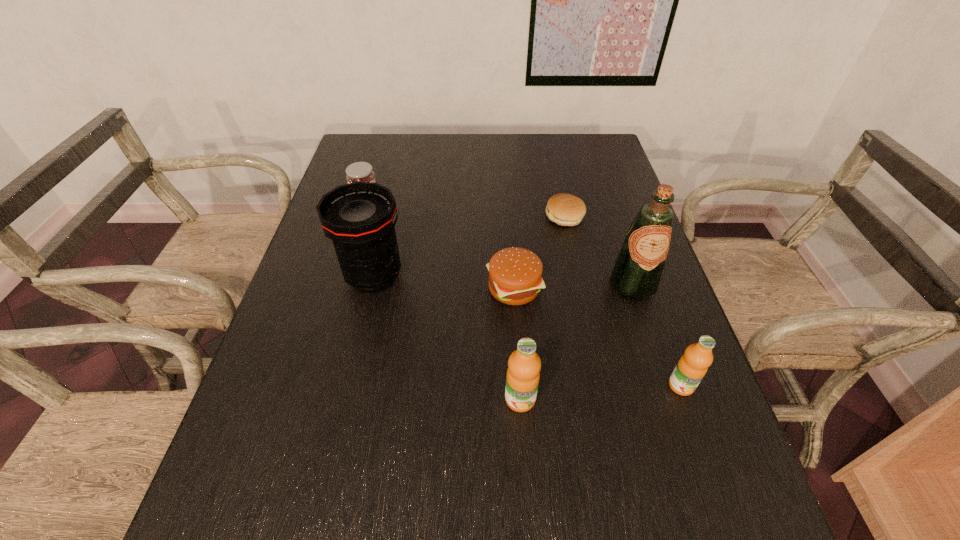
Find the location of a particular element. olive oil at the right edge is located at coordinates (636, 274).

Locate an element on the screen. The width and height of the screenshot is (960, 540). patty that is positioned at the right edge is located at coordinates click(564, 209).

You are a GUI agent. You are given a task and a screenshot of the screen. Output one action in this format:
    pyautogui.click(x=<x>, y=<y>)
    Task: Click on the vacant space at the far edge
    This screenshot has height=540, width=960.
    Given the screenshot: What is the action you would take?
    pyautogui.click(x=522, y=141)

The image size is (960, 540). What are the coordinates of `vacant space at the near edge of the desktop` in the screenshot? It's located at (609, 441).

Where is `vacant space at the left edge of the desktop`? The width and height of the screenshot is (960, 540). vacant space at the left edge of the desktop is located at coordinates (338, 299).

Image resolution: width=960 pixels, height=540 pixels. I want to click on blank space at the right edge of the desktop, so click(x=596, y=225).

Identify the location of free space at the near left corner. Image resolution: width=960 pixels, height=540 pixels. (276, 464).

The image size is (960, 540). What are the coordinates of `free space at the far right corner of the desktop` in the screenshot? It's located at (612, 161).

Where is `free area in between the tallest object and the third object from right to left`? The height and width of the screenshot is (540, 960). free area in between the tallest object and the third object from right to left is located at coordinates (598, 251).

Locate an element on the screen. Image resolution: width=960 pixels, height=540 pixels. vacant space that's between the olive oil and the fifth tallest object is located at coordinates (499, 243).